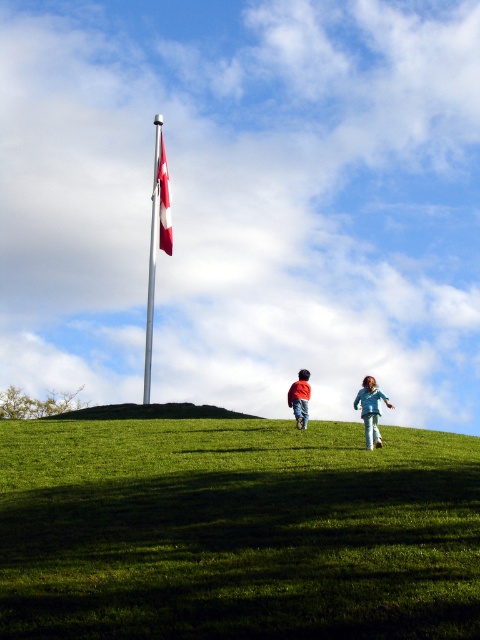
You are a photographer trying to capture the flagpole and the flag in a single shot. Based on their widths, will the polished metal flag pole at center and the red fabric flag at upper center fit side by side within the camera frame if the flagpole takes up 10 units of width?

The polished metal flag pole at center might be wider than the red fabric flag at upper center. If the flagpole takes up 10 units of width, the flag could be narrower, so they might fit side by side depending on the total frame width.

You are a photographer trying to capture a photo of the light blue denim pants at lower right and the green grassy hillside at center. Based on their heights, which object should you focus on first to ensure both are in frame?

The green grassy hillside at center is shorter than the light blue denim pants at lower right. To ensure both are in frame, focus on the light blue denim pants at lower right first, then adjust to include the hillside.